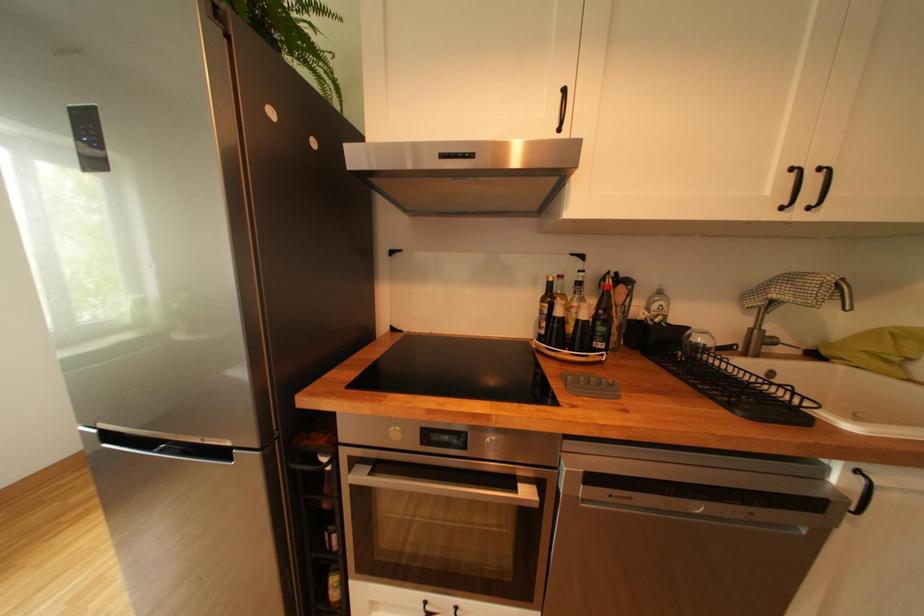
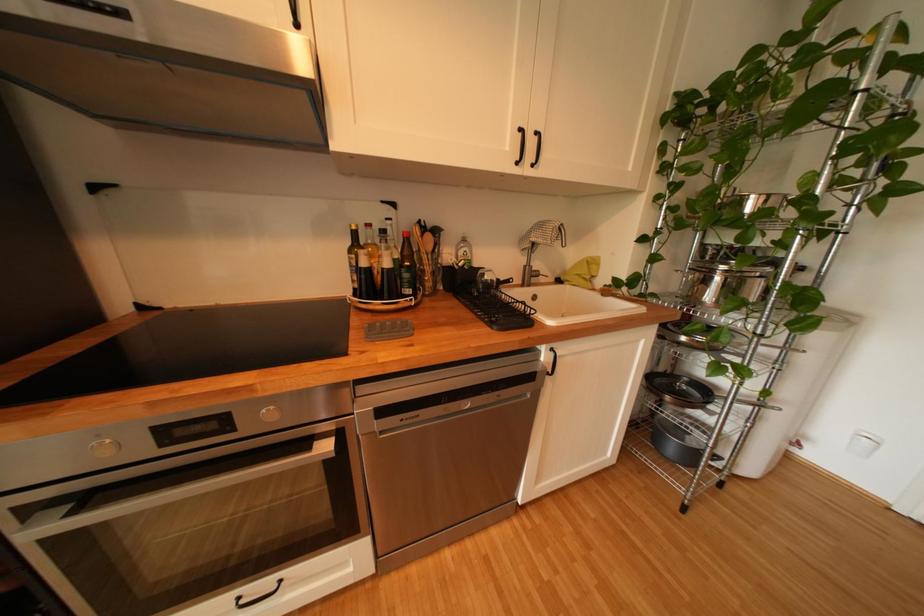
Question: Which direction would the cameraman need to move to produce the second image? Reply with the corresponding letter.

Choices:
 (A) Left
 (B) Right
 (C) Forward
 (D) Backward

Answer: (B)